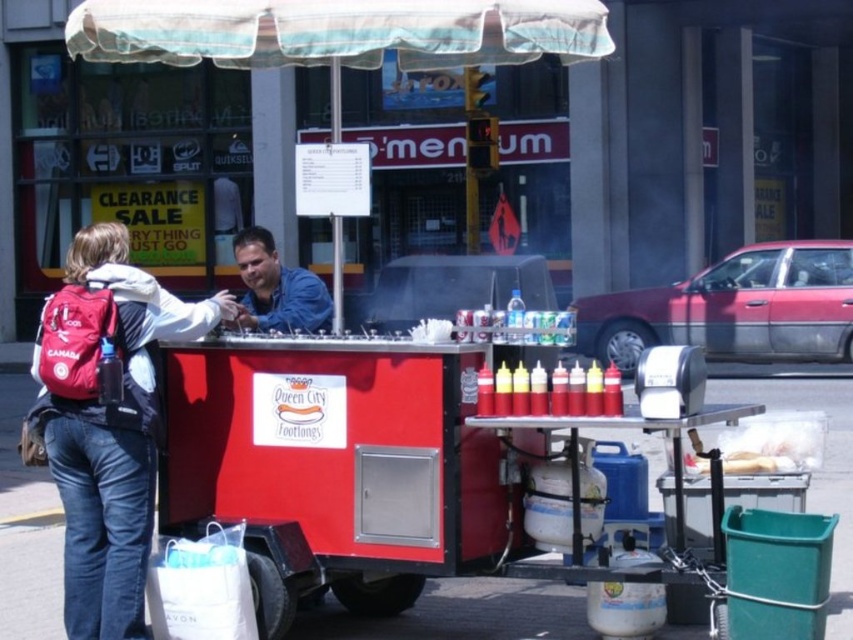
You are a customer at the Queen City Footlongs cart and you see two people in denim clothing. The denim jacket at left and the blue denim shirt at center. Which one is more to the left?

The denim jacket at left is more to the left than the blue denim shirt at center.

You are a customer at the hot dog cart. You see a denim jacket at left and a blue denim shirt at center. Which clothing item is positioned lower?

The denim jacket at left is positioned lower than the blue denim shirt at center.

You are a customer at the Queen City Footlongs cart and you see two people wearing denim clothing. The denim jacket at left and the blue denim shirt at center. Which one is shorter in height?

The denim jacket at left is not as tall as the blue denim shirt at center, so the denim jacket at left is shorter in height.